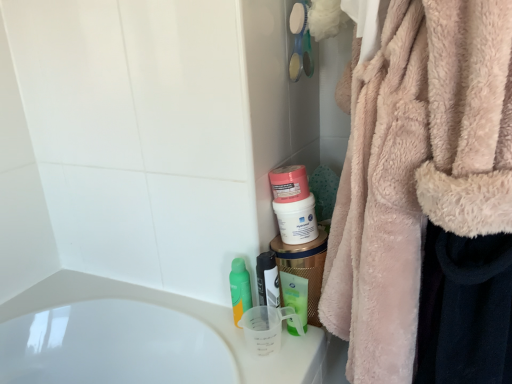
What do you see at coordinates (240, 289) in the screenshot?
I see `green matte bottle at center, the 4th mouthwash in the right-to-left sequence` at bounding box center [240, 289].

Describe the element at coordinates (295, 295) in the screenshot. I see `green plastic mouthwash at lower center, acting as the fourth mouthwash starting from the left` at that location.

The image size is (512, 384). I want to click on translucent plastic mouthwash at center, which is the 3th mouthwash in right-to-left order, so click(268, 280).

What is the approximate height of pink matte jar at center, the 2th mouthwash viewed from the right?

pink matte jar at center, the 2th mouthwash viewed from the right, is 7.11 inches in height.

The image size is (512, 384). I want to click on green matte bottle at center, the 1th mouthwash when ordered from left to right, so click(240, 289).

Which of these two, fuzzy pink robe at right or translucent plastic mouthwash at center, which is the 2th mouthwash from left to right, is wider?

Wider between the two is fuzzy pink robe at right.

Is fuzzy pink robe at right far from translucent plastic mouthwash at center, which is the 3th mouthwash in right-to-left order?

That's not correct — fuzzy pink robe at right is a little close to translucent plastic mouthwash at center, which is the 3th mouthwash in right-to-left order.

Which is more to the right, fuzzy pink robe at right or translucent plastic mouthwash at center, which is the 2th mouthwash from left to right?

fuzzy pink robe at right is more to the right.

Identify the location of towel to the right of translucent plastic mouthwash at center, which is the 3th mouthwash in right-to-left order. (426, 199).

Is point (469, 124) positioned before point (283, 285)?

Yes.

From a real-world perspective, is fuzzy pink robe at right beneath green plastic mouthwash at lower center, the 1th mouthwash from the right?

No.

Is fuzzy pink robe at right smaller than green plastic mouthwash at lower center, acting as the fourth mouthwash starting from the left?

Incorrect, fuzzy pink robe at right is not smaller in size than green plastic mouthwash at lower center, acting as the fourth mouthwash starting from the left.

Can you confirm if pink matte jar at center, the 2th mouthwash viewed from the right, is smaller than fuzzy pink robe at right?

Yes.

Between pink matte jar at center, placed as the third mouthwash when sorted from left to right, and fuzzy pink robe at right, which one has smaller width?

With smaller width is pink matte jar at center, placed as the third mouthwash when sorted from left to right.

How different are the orientations of pink matte jar at center, placed as the third mouthwash when sorted from left to right, and fuzzy pink robe at right in degrees?

76.9 degrees.

From a real-world perspective, is pink matte jar at center, the 2th mouthwash viewed from the right, physically above fuzzy pink robe at right?

Incorrect, from a real-world perspective, pink matte jar at center, the 2th mouthwash viewed from the right, is lower than fuzzy pink robe at right.

Can you confirm if green plastic mouthwash at lower center, acting as the fourth mouthwash starting from the left, is positioned to the right of fuzzy pink robe at right?

No, green plastic mouthwash at lower center, acting as the fourth mouthwash starting from the left, is not to the right of fuzzy pink robe at right.

What are the coordinates of `towel on the right of the green plastic mouthwash at lower center, acting as the fourth mouthwash starting from the left` in the screenshot? It's located at (426, 199).

Is the depth of green plastic mouthwash at lower center, the 1th mouthwash from the right, greater than that of fuzzy pink robe at right?

Yes, the depth of green plastic mouthwash at lower center, the 1th mouthwash from the right, is greater than that of fuzzy pink robe at right.

Considering the sizes of objects fuzzy pink robe at right and pink matte jar at center, the 2th mouthwash viewed from the right, in the image provided, who is taller, fuzzy pink robe at right or pink matte jar at center, the 2th mouthwash viewed from the right,?

With more height is fuzzy pink robe at right.

Which is behind, point (343, 300) or point (300, 217)?

The point (300, 217) is more distant.

Is fuzzy pink robe at right in front of or behind pink matte jar at center, placed as the third mouthwash when sorted from left to right, in the image?

Visually, fuzzy pink robe at right is located in front of pink matte jar at center, placed as the third mouthwash when sorted from left to right.

Is fuzzy pink robe at right facing away from pink matte jar at center, the 2th mouthwash viewed from the right?

No, fuzzy pink robe at right is not facing away from pink matte jar at center, the 2th mouthwash viewed from the right.

From the image's perspective, is green plastic mouthwash at lower center, the 1th mouthwash from the right, beneath green matte bottle at center, the 1th mouthwash when ordered from left to right?

Yes.

Is green plastic mouthwash at lower center, acting as the fourth mouthwash starting from the left, placed right next to green matte bottle at center, the 4th mouthwash in the right-to-left sequence?

They are not placed beside each other.

How different are the orientations of green plastic mouthwash at lower center, acting as the fourth mouthwash starting from the left, and green matte bottle at center, the 1th mouthwash when ordered from left to right, in degrees?

They differ by 11.9 degrees in their facing directions.

Who is taller, green plastic mouthwash at lower center, acting as the fourth mouthwash starting from the left, or green matte bottle at center, the 4th mouthwash in the right-to-left sequence?

Standing taller between the two is green matte bottle at center, the 4th mouthwash in the right-to-left sequence.

Between green matte bottle at center, the 1th mouthwash when ordered from left to right, and translucent plastic mouthwash at center, which is the 3th mouthwash in right-to-left order, which one has less height?

With less height is green matte bottle at center, the 1th mouthwash when ordered from left to right.

In the image, is green matte bottle at center, the 1th mouthwash when ordered from left to right, positioned in front of or behind translucent plastic mouthwash at center, which is the 2th mouthwash from left to right?

green matte bottle at center, the 1th mouthwash when ordered from left to right, is positioned farther from the viewer than translucent plastic mouthwash at center, which is the 2th mouthwash from left to right.

Are green matte bottle at center, the 1th mouthwash when ordered from left to right, and translucent plastic mouthwash at center, which is the 2th mouthwash from left to right, making contact?

Absolutely, green matte bottle at center, the 1th mouthwash when ordered from left to right, is next to and touching translucent plastic mouthwash at center, which is the 2th mouthwash from left to right.

Locate an element on the screen. The width and height of the screenshot is (512, 384). mouthwash located on the left of translucent plastic mouthwash at center, which is the 2th mouthwash from left to right is located at coordinates [x=240, y=289].

The image size is (512, 384). In order to click on towel in front of the translucent plastic mouthwash at center, which is the 3th mouthwash in right-to-left order in this screenshot , I will do `click(426, 199)`.

From the fuzzy pink robe at right, count 2nd mouthwashs backward and point to it. Please provide its 2D coordinates.

[(295, 295)]

When comparing their distances from translucent plastic mouthwash at center, which is the 2th mouthwash from left to right, does green matte bottle at center, the 1th mouthwash when ordered from left to right, or pink matte jar at center, the 2th mouthwash viewed from the right, seem closer?

green matte bottle at center, the 1th mouthwash when ordered from left to right.

When comparing their distances from green plastic mouthwash at lower center, the 1th mouthwash from the right, does fuzzy pink robe at right or green matte bottle at center, the 1th mouthwash when ordered from left to right, seem further?

fuzzy pink robe at right is positioned further to the anchor green plastic mouthwash at lower center, the 1th mouthwash from the right.

Which object lies nearer to the anchor point green matte bottle at center, the 1th mouthwash when ordered from left to right, fuzzy pink robe at right or translucent plastic mouthwash at center, which is the 2th mouthwash from left to right?

translucent plastic mouthwash at center, which is the 2th mouthwash from left to right, is closer to green matte bottle at center, the 1th mouthwash when ordered from left to right.

Looking at the image, which one is located closer to translucent plastic mouthwash at center, which is the 2th mouthwash from left to right, green plastic mouthwash at lower center, the 1th mouthwash from the right, or fuzzy pink robe at right?

green plastic mouthwash at lower center, the 1th mouthwash from the right, is closer to translucent plastic mouthwash at center, which is the 2th mouthwash from left to right.

From the image, which object appears to be farther from green plastic mouthwash at lower center, acting as the fourth mouthwash starting from the left, green matte bottle at center, the 4th mouthwash in the right-to-left sequence, or fuzzy pink robe at right?

fuzzy pink robe at right is further to green plastic mouthwash at lower center, acting as the fourth mouthwash starting from the left.

Considering their positions, is green matte bottle at center, the 1th mouthwash when ordered from left to right, positioned further to fuzzy pink robe at right than translucent plastic mouthwash at center, which is the 2th mouthwash from left to right?

green matte bottle at center, the 1th mouthwash when ordered from left to right, lies further to fuzzy pink robe at right than the other object.

Considering their positions, is green plastic mouthwash at lower center, the 1th mouthwash from the right, positioned closer to green matte bottle at center, the 4th mouthwash in the right-to-left sequence, than fuzzy pink robe at right?

Among the two, green plastic mouthwash at lower center, the 1th mouthwash from the right, is located nearer to green matte bottle at center, the 4th mouthwash in the right-to-left sequence.

Which object lies nearer to the anchor point green matte bottle at center, the 4th mouthwash in the right-to-left sequence, translucent plastic mouthwash at center, which is the 2th mouthwash from left to right, or green plastic mouthwash at lower center, the 1th mouthwash from the right?

translucent plastic mouthwash at center, which is the 2th mouthwash from left to right, is closer to green matte bottle at center, the 4th mouthwash in the right-to-left sequence.

Identify the location of mouthwash between fuzzy pink robe at right and green plastic mouthwash at lower center, acting as the fourth mouthwash starting from the left, along the z-axis. The width and height of the screenshot is (512, 384). (268, 280).

What are the coordinates of `mouthwash between pink matte jar at center, the 2th mouthwash viewed from the right, and green matte bottle at center, the 4th mouthwash in the right-to-left sequence, vertically` in the screenshot? It's located at (268, 280).